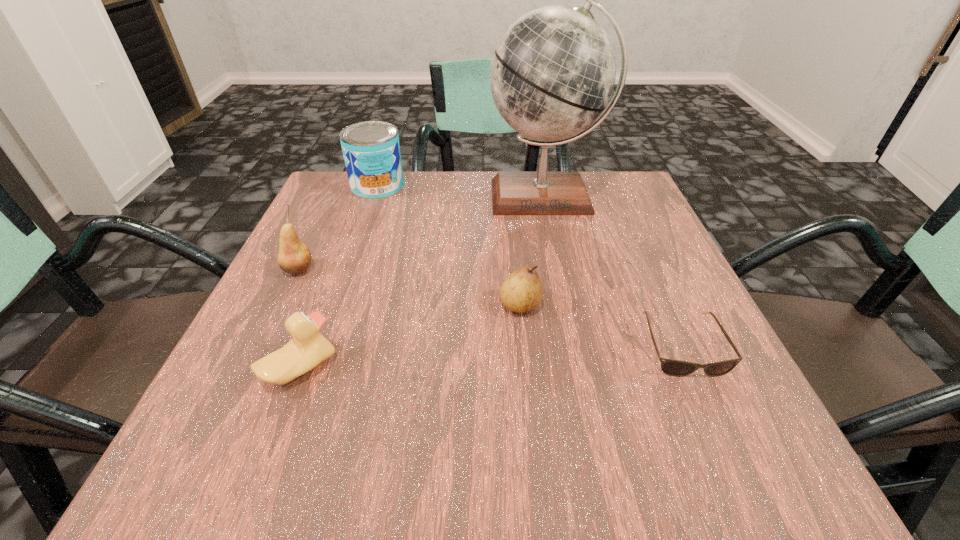
You are a GUI agent. You are given a task and a screenshot of the screen. Output one action in this format:
    pyautogui.click(x=<x>, y=<y>)
    Task: Click on the blank space located 0.240m on the right of the left pear
    The height and width of the screenshot is (540, 960).
    Given the screenshot: What is the action you would take?
    pyautogui.click(x=440, y=269)

Where is `free space located on the front of the shorter pear`? This screenshot has height=540, width=960. free space located on the front of the shorter pear is located at coordinates (x=537, y=465).

Where is `vacant space located 0.120m at the beak of the duck`? Image resolution: width=960 pixels, height=540 pixels. vacant space located 0.120m at the beak of the duck is located at coordinates (414, 368).

Locate an element on the screen. This screenshot has height=540, width=960. vacant position located on the lenses of the sunglasses is located at coordinates (738, 471).

The height and width of the screenshot is (540, 960). I want to click on globe that is positioned at the far edge, so click(x=553, y=72).

The height and width of the screenshot is (540, 960). What are the coordinates of `can that is at the far edge` in the screenshot? It's located at (371, 150).

This screenshot has width=960, height=540. What are the coordinates of `can at the left edge` in the screenshot? It's located at (371, 150).

You are a GUI agent. You are given a task and a screenshot of the screen. Output one action in this format:
    pyautogui.click(x=<x>, y=<y>)
    Task: Click on the pear located in the left edge section of the desktop
    The height and width of the screenshot is (540, 960).
    Given the screenshot: What is the action you would take?
    pyautogui.click(x=294, y=257)

Where is `duck present at the left edge`? duck present at the left edge is located at coordinates (308, 348).

Locate an element on the screen. Image resolution: width=960 pixels, height=540 pixels. globe present at the right edge is located at coordinates (553, 72).